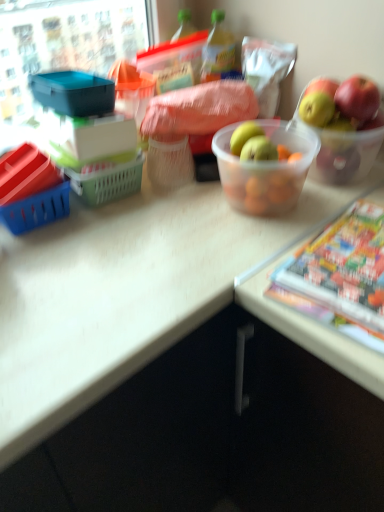
Question: From the image's perspective, would you say multicolored glossy comic book at lower right is shown under translucent plastic bowl at center?

Choices:
 (A) yes
 (B) no

Answer: (A)

Question: Is multicolored glossy comic book at lower right behind translucent plastic bowl at center?

Choices:
 (A) no
 (B) yes

Answer: (A)

Question: Does multicolored glossy comic book at lower right have a smaller size compared to translucent plastic bowl at center?

Choices:
 (A) no
 (B) yes

Answer: (B)

Question: From a real-world perspective, is multicolored glossy comic book at lower right beneath translucent plastic bowl at center?

Choices:
 (A) yes
 (B) no

Answer: (A)

Question: From the image's perspective, is multicolored glossy comic book at lower right located above translucent plastic bowl at center?

Choices:
 (A) yes
 (B) no

Answer: (B)

Question: Is multicolored glossy comic book at lower right to the right of translucent plastic bowl at center from the viewer's perspective?

Choices:
 (A) yes
 (B) no

Answer: (A)

Question: Can you confirm if translucent plastic bowl at center is smaller than green plastic bottle at center?

Choices:
 (A) no
 (B) yes

Answer: (A)

Question: Is translucent plastic bowl at center shorter than green plastic bottle at center?

Choices:
 (A) yes
 (B) no

Answer: (B)

Question: Can you confirm if translucent plastic bowl at center is taller than green plastic bottle at center?

Choices:
 (A) yes
 (B) no

Answer: (A)

Question: Is translucent plastic bowl at center oriented towards green plastic bottle at center?

Choices:
 (A) no
 (B) yes

Answer: (A)

Question: From the image's perspective, is translucent plastic bowl at center over green plastic bottle at center?

Choices:
 (A) yes
 (B) no

Answer: (B)

Question: Is translucent plastic bowl at center looking in the opposite direction of green plastic bottle at center?

Choices:
 (A) yes
 (B) no

Answer: (B)

Question: Does green plastic bottle at center have a greater width compared to multicolored glossy comic book at lower right?

Choices:
 (A) no
 (B) yes

Answer: (A)